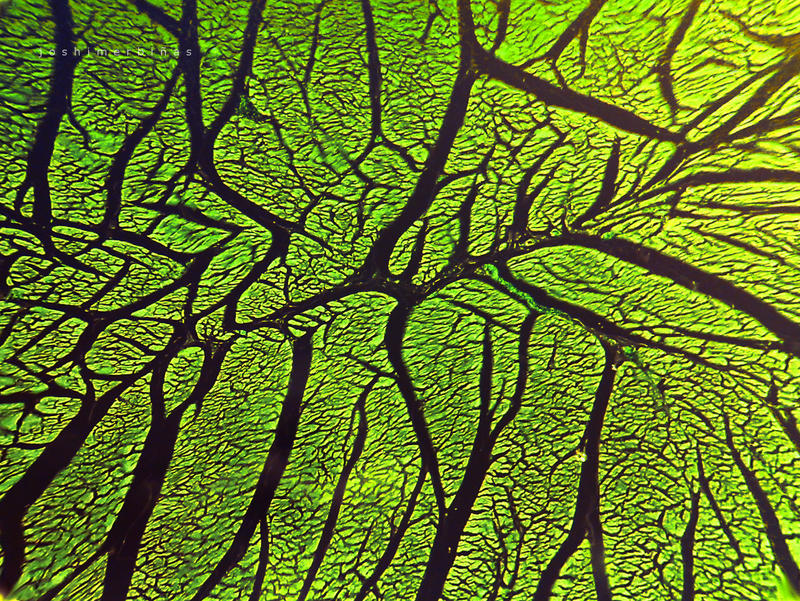
Locate an element on the screen. This screenshot has width=800, height=601. area of lower lighting is located at coordinates (26, 452).